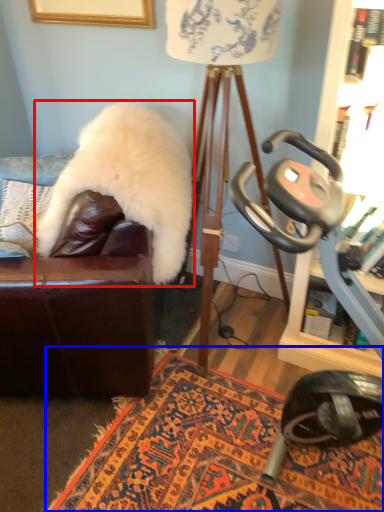
Question: Among these objects, which one is nearest to the camera, fur coat (highlighted by a red box) or mat (highlighted by a blue box)?

Choices:
 (A) fur coat
 (B) mat

Answer: (B)